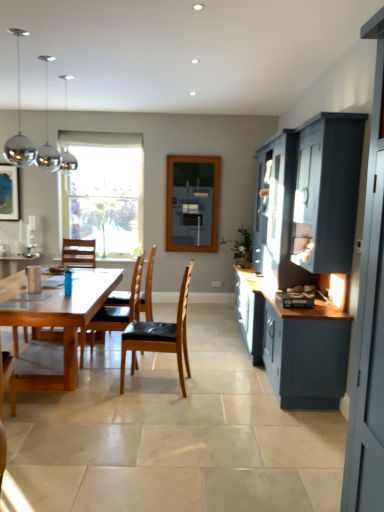
Based on the photo, in order to face light brown wooden table at center, should I rotate leftwards or rightwards?

A 18.092 degree turn to the left will do.

What is the approximate width of matte glass window screen at center?

It is 10.78 centimeters.

Looking at this image, what is the approximate height of brown leather chair at center, arranged as the first chair when viewed from the back?

It is 1.14 meters.

What do you see at coordinates (9, 193) in the screenshot? This screenshot has width=384, height=512. I see `matte wooden picture frame at left` at bounding box center [9, 193].

The width and height of the screenshot is (384, 512). I want to click on clear glass window at center, so click(x=104, y=191).

What is the approximate height of satin silver toaster at lower right?

satin silver toaster at lower right is 3.67 inches in height.

The height and width of the screenshot is (512, 384). Find the location of `light brown wooden table at center`. light brown wooden table at center is located at coordinates (64, 323).

Consider the image. Which of these two, matte wooden picture frame at left or matte glass window screen at center, is bigger?

With larger size is matte glass window screen at center.

From a real-world perspective, who is located lower, matte wooden picture frame at left or matte glass window screen at center?

In real-world perspective, matte glass window screen at center is lower.

Is matte wooden picture frame at left to the left or to the right of matte glass window screen at center in the image?

Based on their positions, matte wooden picture frame at left is located to the left of matte glass window screen at center.

From the image's perspective, which is below, matte wooden picture frame at left or matte glass window screen at center?

matte glass window screen at center.

The image size is (384, 512). I want to click on the 3rd chair to the right of the light brown wooden table at center, counting from the anchor's position, so click(x=160, y=335).

Could you tell me if light brown wooden chair at center, positioned as the third chair in back-to-front order, is turned towards light brown wooden table at center?

Yes, light brown wooden chair at center, positioned as the third chair in back-to-front order, is oriented towards light brown wooden table at center.

Does light brown wooden chair at center, acting as the 1th chair starting from the front, have a greater height compared to light brown wooden table at center?

Yes, light brown wooden chair at center, acting as the 1th chair starting from the front, is taller than light brown wooden table at center.

Does point (177, 197) come farther from viewer compared to point (1, 193)?

Yes, it is behind point (1, 193).

From the image's perspective, is matte glass window screen at center located above matte wooden picture frame at left?

Incorrect, from the image's perspective, matte glass window screen at center is lower than matte wooden picture frame at left.

Is matte glass window screen at center located outside matte wooden picture frame at left?

Yes.

From a real-world perspective, between satin silver toaster at lower right and clear glass window at center, who is vertically lower?

From a 3D spatial view, satin silver toaster at lower right is below.

Between point (309, 293) and point (68, 221), which one is positioned behind?

The point (68, 221) is behind.

Looking at this image, from the image's perspective, which object appears higher, satin silver toaster at lower right or clear glass window at center?

clear glass window at center.

Would you say satin silver toaster at lower right is a long distance from clear glass window at center?

That's right, there is a large distance between satin silver toaster at lower right and clear glass window at center.

Can we say clear glass window at center lies outside wooden chair with black seat cushion at center, which appears as the 2th chair when viewed from the back?

Yes, clear glass window at center is not within wooden chair with black seat cushion at center, which appears as the 2th chair when viewed from the back.

Which is behind, point (131, 245) or point (139, 270)?

The point (131, 245) is farther from the camera.

Which object is more forward, clear glass window at center or wooden chair with black seat cushion at center, arranged as the second chair when viewed from the front?

Positioned in front is wooden chair with black seat cushion at center, arranged as the second chair when viewed from the front.

Is clear glass window at center to the right of wooden chair with black seat cushion at center, which appears as the 2th chair when viewed from the back, from the viewer's perspective?

In fact, clear glass window at center is to the left of wooden chair with black seat cushion at center, which appears as the 2th chair when viewed from the back.

Considering the sizes of matte wooden picture frame at left and light brown wooden table at center in the image, is matte wooden picture frame at left bigger or smaller than light brown wooden table at center?

Clearly, matte wooden picture frame at left is smaller in size than light brown wooden table at center.

Considering the relative sizes of matte wooden picture frame at left and light brown wooden table at center in the image provided, is matte wooden picture frame at left shorter than light brown wooden table at center?

No.

Does matte wooden picture frame at left turn towards light brown wooden table at center?

No, matte wooden picture frame at left is not oriented towards light brown wooden table at center.

Between light brown wooden table at center and satin silver toaster at lower right, which one appears on the left side from the viewer's perspective?

light brown wooden table at center is more to the left.

From the image's perspective, relative to satin silver toaster at lower right, is light brown wooden table at center above or below?

Based on their image positions, light brown wooden table at center is located beneath satin silver toaster at lower right.

Is point (88, 296) in front of point (301, 298)?

No, it is behind (301, 298).

Where is `window screen that appears below the matte wooden picture frame at left (from the image's perspective)`? window screen that appears below the matte wooden picture frame at left (from the image's perspective) is located at coordinates (192, 203).

Find the location of `kitchen & dining room table that is in front of the light brown wooden chair at center, positioned as the third chair in back-to-front order`. kitchen & dining room table that is in front of the light brown wooden chair at center, positioned as the third chair in back-to-front order is located at coordinates (64, 323).

Estimate the real-world distances between objects in this image. Which object is closer to brown leather chair at center, arranged as the first chair when viewed from the back, clear glass window at center or matte glass window screen at center?

clear glass window at center.

Based on their spatial positions, is satin silver toaster at lower right or matte glass window screen at center closer to light brown wooden table at center?

satin silver toaster at lower right is positioned closer to the anchor light brown wooden table at center.

Based on their spatial positions, is wooden chair with black seat cushion at center, arranged as the second chair when viewed from the front, or matte glass window screen at center further from light brown wooden chair at center, acting as the 1th chair starting from the front?

The object further to light brown wooden chair at center, acting as the 1th chair starting from the front, is matte glass window screen at center.

From the image, which object appears to be farther from light brown wooden table at center, brown leather chair at center, arranged as the first chair when viewed from the back, or satin silver toaster at lower right?

Among the two, satin silver toaster at lower right is located further to light brown wooden table at center.

Based on the photo, based on their spatial positions, is wooden chair with black seat cushion at center, which appears as the 2th chair when viewed from the back, or matte glass window screen at center closer to light brown wooden table at center?

Based on the image, wooden chair with black seat cushion at center, which appears as the 2th chair when viewed from the back, appears to be nearer to light brown wooden table at center.

When comparing their distances from light brown wooden chair at center, acting as the 1th chair starting from the front, does brown leather chair at center, which is the third chair in front-to-back order, or wooden chair with black seat cushion at center, arranged as the second chair when viewed from the front, seem closer?

The object closer to light brown wooden chair at center, acting as the 1th chair starting from the front, is wooden chair with black seat cushion at center, arranged as the second chair when viewed from the front.

Considering their positions, is clear glass window at center positioned further to matte wooden picture frame at left than matte glass window screen at center?

matte glass window screen at center lies further to matte wooden picture frame at left than the other object.

Estimate the real-world distances between objects in this image. Which object is closer to brown leather chair at center, which is the third chair in front-to-back order, wooden chair with black seat cushion at center, which appears as the 2th chair when viewed from the back, or clear glass window at center?

Based on the image, wooden chair with black seat cushion at center, which appears as the 2th chair when viewed from the back, appears to be nearer to brown leather chair at center, which is the third chair in front-to-back order.

The height and width of the screenshot is (512, 384). What are the coordinates of `chair located between brown leather chair at center, which is the third chair in front-to-back order, and satin silver toaster at lower right in the left-right direction` in the screenshot? It's located at (160, 335).

The height and width of the screenshot is (512, 384). I want to click on window screen between light brown wooden table at center and matte wooden picture frame at left from front to back, so click(x=192, y=203).

Find the location of `chair positioned between wooden chair with black seat cushion at center, which appears as the 2th chair when viewed from the back, and clear glass window at center from near to far`. chair positioned between wooden chair with black seat cushion at center, which appears as the 2th chair when viewed from the back, and clear glass window at center from near to far is located at coordinates (148, 288).

Image resolution: width=384 pixels, height=512 pixels. Find the location of `window screen between matte wooden picture frame at left and satin silver toaster at lower right in the horizontal direction`. window screen between matte wooden picture frame at left and satin silver toaster at lower right in the horizontal direction is located at coordinates (192, 203).